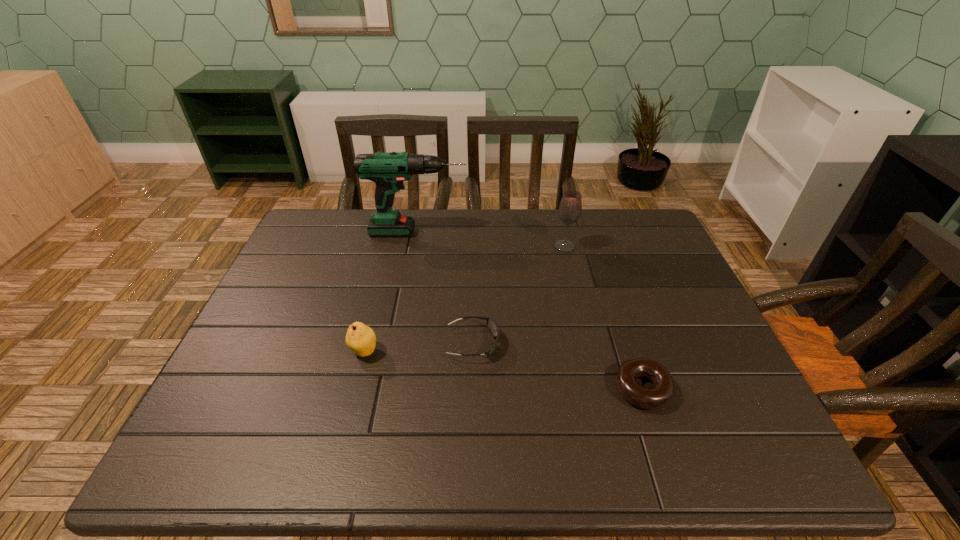
The width and height of the screenshot is (960, 540). Find the location of `free space at the far left corner`. free space at the far left corner is located at coordinates [x=323, y=246].

Locate an element on the screen. This screenshot has width=960, height=540. blank space at the near left corner of the desktop is located at coordinates (258, 458).

At what (x,y) coordinates should I click in order to perform the action: click on vacant region at the far right corner of the desktop. Please return your answer as a coordinate pair (x, y). Looking at the image, I should click on (658, 242).

Where is `vacant region between the second tallest object and the pear`? vacant region between the second tallest object and the pear is located at coordinates (465, 299).

I want to click on free space between the glass drink container and the third tallest object, so click(x=465, y=299).

Locate an element on the screen. free space between the second object from right to left and the farthest object is located at coordinates (492, 239).

This screenshot has width=960, height=540. Find the location of `unoccupied position between the farthest object and the pear`. unoccupied position between the farthest object and the pear is located at coordinates (391, 292).

Locate an element on the screen. Image resolution: width=960 pixels, height=540 pixels. free space between the drill and the fourth object from left to right is located at coordinates (492, 239).

The height and width of the screenshot is (540, 960). I want to click on unoccupied area between the fourth object from left to right and the drill, so click(492, 239).

This screenshot has width=960, height=540. What are the coordinates of `free area in between the pear and the nearest object` in the screenshot? It's located at (503, 370).